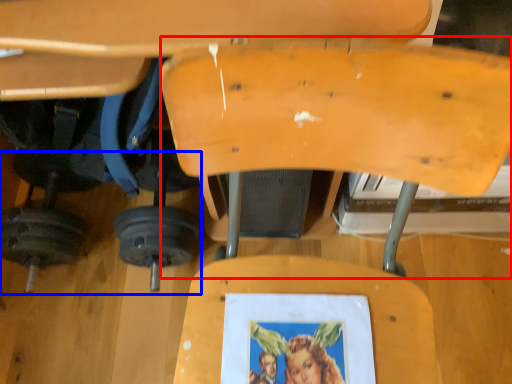
Question: Which of the following is the closest to the observer, swivel chair (highlighted by a red box) or barbell (highlighted by a blue box)?

Choices:
 (A) swivel chair
 (B) barbell

Answer: (A)